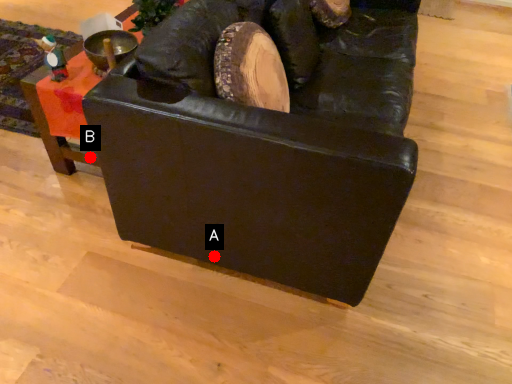
Question: Two points are circled on the image, labeled by A and B beside each circle. Which point is closer to the camera taking this photo?

Choices:
 (A) A is closer
 (B) B is closer

Answer: (A)